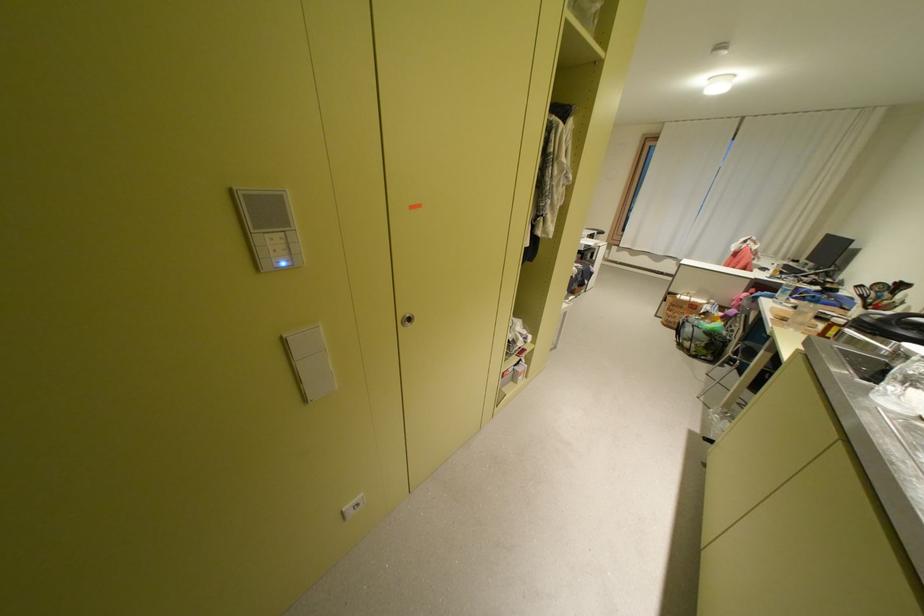
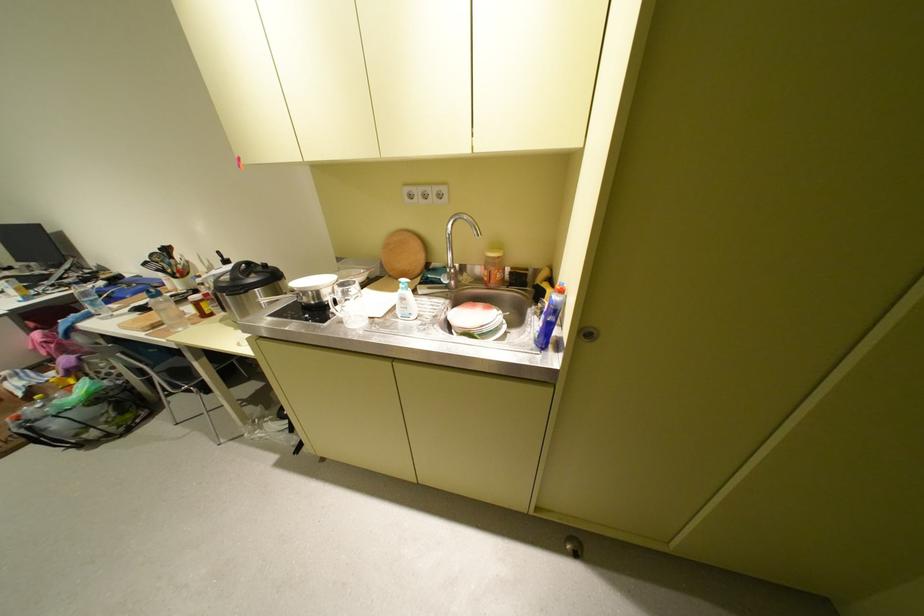
The point at (892,317) is marked in the first image. Where is the corresponding point in the second image?

(237, 277)